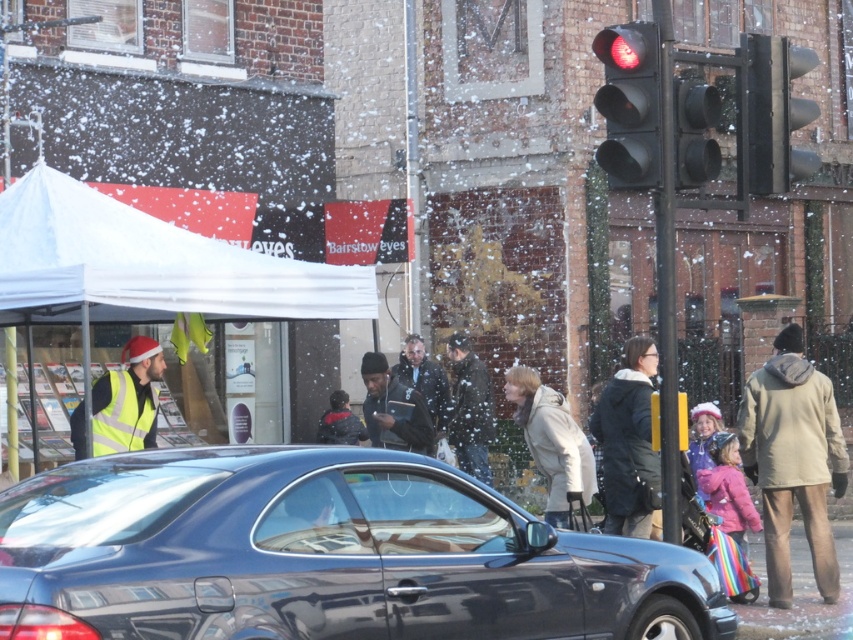
Question: Is black matte coat at center to the left of dark gray suit at center from the viewer's perspective?

Choices:
 (A) no
 (B) yes

Answer: (A)

Question: Can you confirm if white fabric canopy at upper left is positioned to the right of beige wool coat at right?

Choices:
 (A) no
 (B) yes

Answer: (A)

Question: Which object is positioned farthest from the dark gray coat at center?

Choices:
 (A) white fabric canopy at upper left
 (B) light beige coat at center

Answer: (A)

Question: Among these objects, which one is farthest from the camera?

Choices:
 (A) beige wool coat at right
 (B) matte black traffic light at upper right
 (C) light beige coat at center
 (D) black matte traffic light at upper right

Answer: (C)

Question: Can you confirm if beige wool coat at right is positioned to the left of yellow reflective vest at left?

Choices:
 (A) no
 (B) yes

Answer: (A)

Question: Which of these objects is positioned farthest from the dark blue jacket at center?

Choices:
 (A) yellow reflective vest at left
 (B) dark gray suit at center
 (C) black matte traffic light at upper right

Answer: (C)